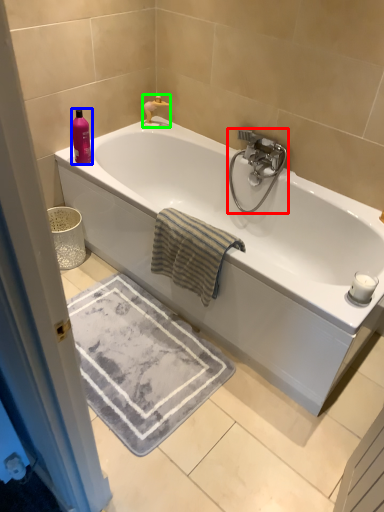
Question: Which is nearer to the tap (highlighted by a red box)? toiletry (highlighted by a blue box) or faucet (highlighted by a green box).

Choices:
 (A) toiletry
 (B) faucet

Answer: (B)